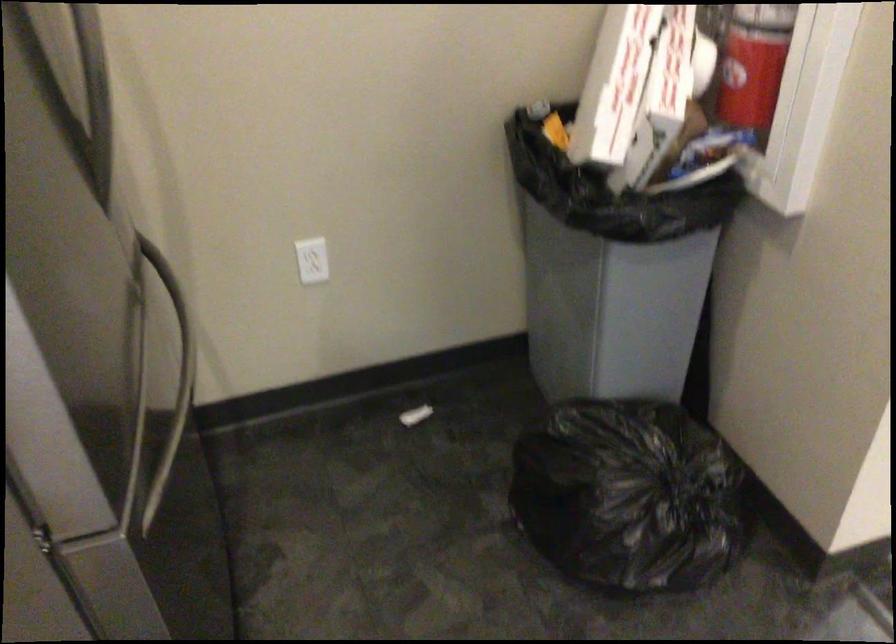
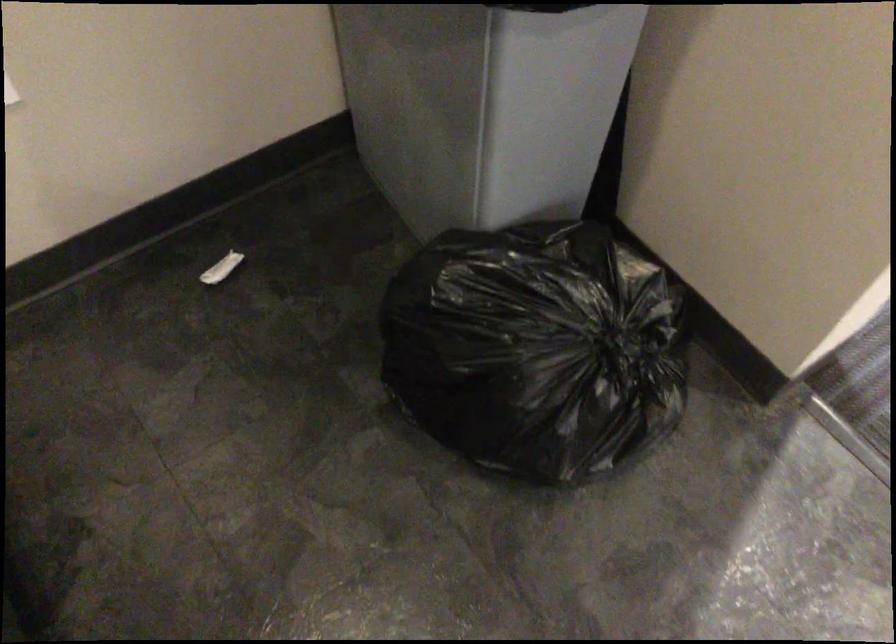
Question: The first image is from the beginning of the video and the second image is from the end. How did the camera likely rotate when shooting the video?

Choices:
 (A) Left
 (B) Right
 (C) Up
 (D) Down

Answer: (D)